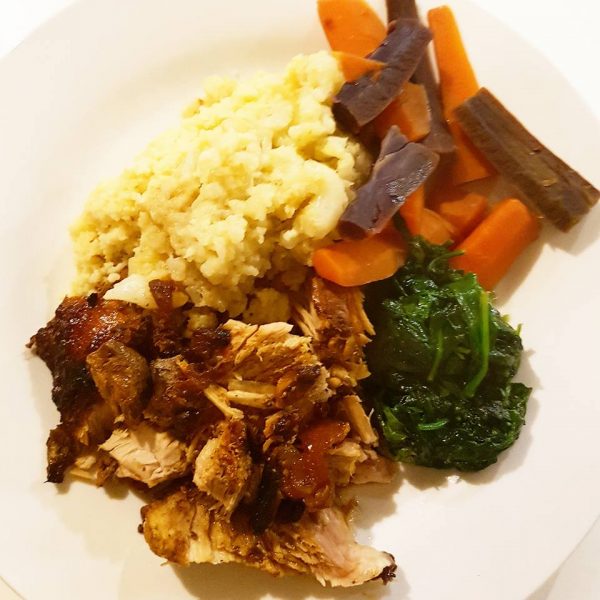
I want to click on plate with food on it, so click(x=320, y=269).